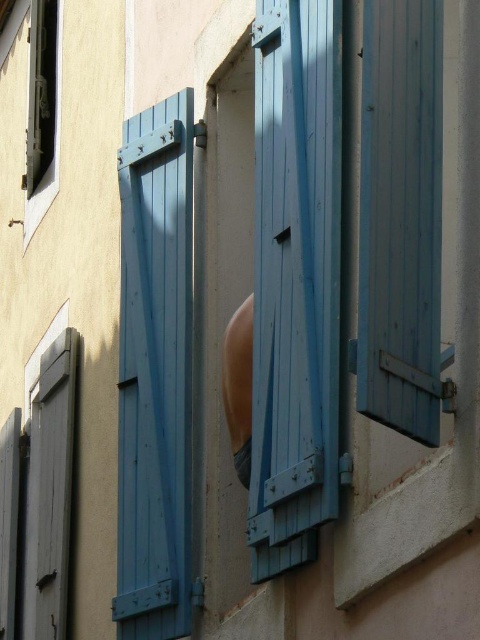
Which is in front, point (169, 289) or point (57, 99)?

Point (169, 289) is more forward.

Between matte blue wooden shutter at left and matte black window at upper left, which one has more height?

matte blue wooden shutter at left is taller.

In order to click on matte blue wooden shutter at left in this screenshot , I will do `click(155, 372)`.

Locate an element on the screen. This screenshot has width=480, height=640. matte blue wooden shutter at left is located at coordinates (155, 372).

Between matte blue wooden shutter at left and smooth peach skin at center, which one is positioned higher?

smooth peach skin at center is above.

Consider the image. Is matte blue wooden shutter at left bigger than smooth peach skin at center?

Yes, matte blue wooden shutter at left is bigger than smooth peach skin at center.

What do you see at coordinates (155, 372) in the screenshot? This screenshot has height=640, width=480. I see `matte blue wooden shutter at left` at bounding box center [155, 372].

At what (x,y) coordinates should I click in order to perform the action: click on matte blue wooden shutter at left. Please return your answer as a coordinate pair (x, y). This screenshot has width=480, height=640. Looking at the image, I should click on (155, 372).

In the scene shown: Can you confirm if matte black window at upper left is shorter than smooth peach skin at center?

Yes, matte black window at upper left is shorter than smooth peach skin at center.

Is point (43, 176) in front of point (247, 476)?

That is False.

What do you see at coordinates (43, 112) in the screenshot?
I see `matte black window at upper left` at bounding box center [43, 112].

This screenshot has width=480, height=640. I want to click on matte black window at upper left, so click(43, 112).